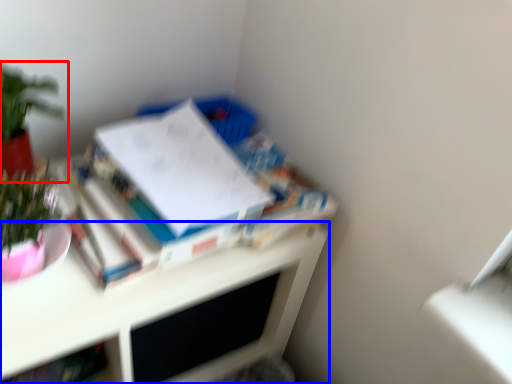
Question: Which point is closer to the camera, houseplant (highlighted by a red box) or desk (highlighted by a blue box)?

Choices:
 (A) houseplant
 (B) desk

Answer: (B)